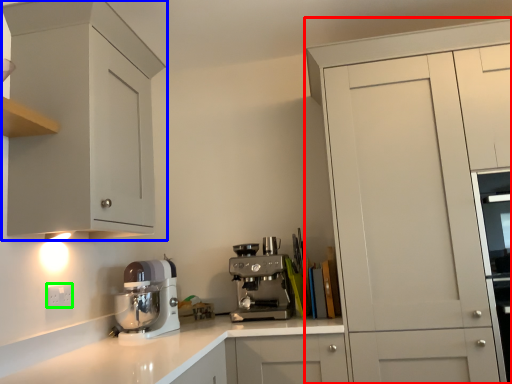
Question: Which object is positioned farthest from cabinetry (highlighted by a red box)? Select from cabinetry (highlighted by a blue box) and electric outlet (highlighted by a green box).

Choices:
 (A) cabinetry
 (B) electric outlet

Answer: (B)